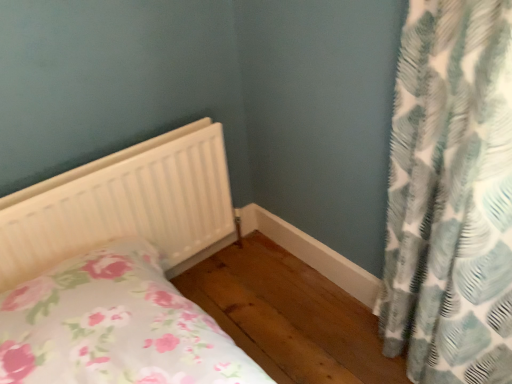
Question: Is teal and white patterned curtain at right a part of white matte radiator at lower left?

Choices:
 (A) yes
 (B) no

Answer: (B)

Question: Is white matte radiator at lower left in front of teal and white patterned curtain at right?

Choices:
 (A) no
 (B) yes

Answer: (A)

Question: Considering the relative positions of white matte radiator at lower left and teal and white patterned curtain at right in the image provided, is white matte radiator at lower left behind teal and white patterned curtain at right?

Choices:
 (A) no
 (B) yes

Answer: (B)

Question: Does white matte radiator at lower left have a greater width compared to teal and white patterned curtain at right?

Choices:
 (A) yes
 (B) no

Answer: (B)

Question: Considering the relative sizes of white matte radiator at lower left and teal and white patterned curtain at right in the image provided, is white matte radiator at lower left smaller than teal and white patterned curtain at right?

Choices:
 (A) yes
 (B) no

Answer: (A)

Question: Does white matte radiator at lower left have a greater height compared to teal and white patterned curtain at right?

Choices:
 (A) no
 (B) yes

Answer: (A)

Question: Is teal and white patterned curtain at right completely or partially outside of white matte radiator at lower left?

Choices:
 (A) yes
 (B) no

Answer: (A)

Question: Is white matte radiator at lower left at the back of teal and white patterned curtain at right?

Choices:
 (A) no
 (B) yes

Answer: (A)

Question: From a real-world perspective, is teal and white patterned curtain at right located higher than white matte radiator at lower left?

Choices:
 (A) no
 (B) yes

Answer: (B)

Question: Is teal and white patterned curtain at right smaller than white matte radiator at lower left?

Choices:
 (A) no
 (B) yes

Answer: (A)

Question: Does teal and white patterned curtain at right have a larger size compared to white matte radiator at lower left?

Choices:
 (A) yes
 (B) no

Answer: (A)

Question: From a real-world perspective, does teal and white patterned curtain at right sit lower than white matte radiator at lower left?

Choices:
 (A) yes
 (B) no

Answer: (B)

Question: Is white matte radiator at lower left to the left or to the right of teal and white patterned curtain at right in the image?

Choices:
 (A) left
 (B) right

Answer: (A)